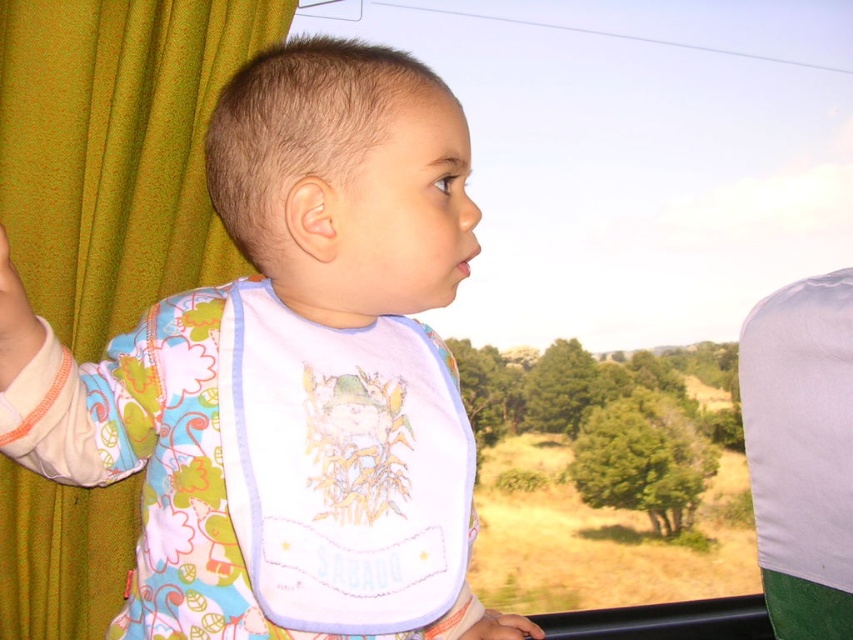
Who is more forward, (120, 580) or (488, 611)?

Positioned in front is point (120, 580).

This screenshot has width=853, height=640. I want to click on green fabric curtain at left, so click(115, 150).

Does green fabric curtain at left appear on the left side of white fabric bib at center?

Yes, green fabric curtain at left is to the left of white fabric bib at center.

Does green fabric curtain at left have a lesser width compared to white fabric bib at center?

Incorrect, green fabric curtain at left's width is not less than white fabric bib at center's.

Between point (122, 124) and point (392, 518), which one is positioned in front?

Positioned in front is point (392, 518).

Where is `green fabric curtain at left`? Image resolution: width=853 pixels, height=640 pixels. green fabric curtain at left is located at coordinates (115, 150).

Which of these two, white fabric bib at center or smooth skin hand at lower center, stands taller?

Standing taller between the two is white fabric bib at center.

Does white fabric bib at center have a lesser width compared to smooth skin hand at lower center?

No, white fabric bib at center is not thinner than smooth skin hand at lower center.

Does point (416, 381) come in front of point (526, 624)?

That is True.

Locate an element on the screen. white fabric bib at center is located at coordinates (341, 467).